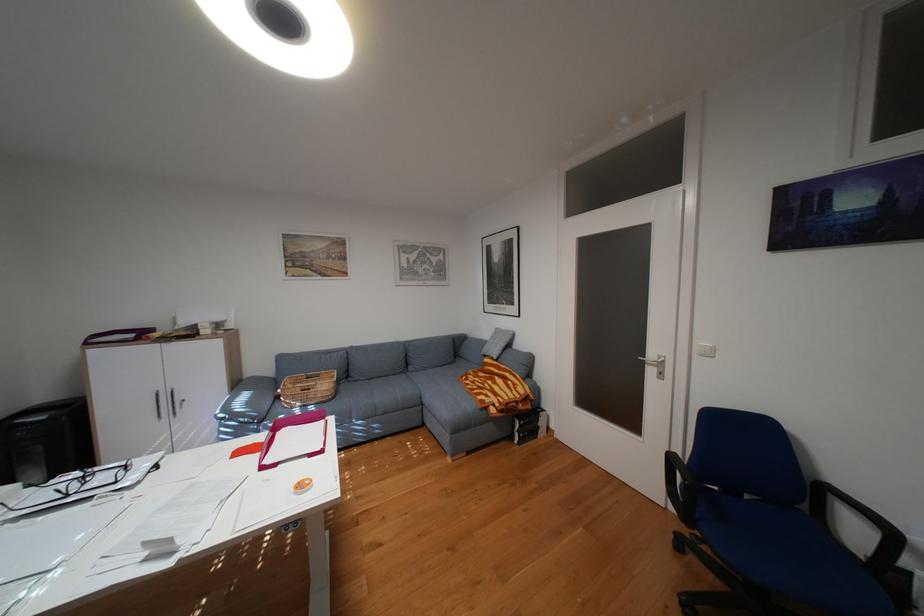
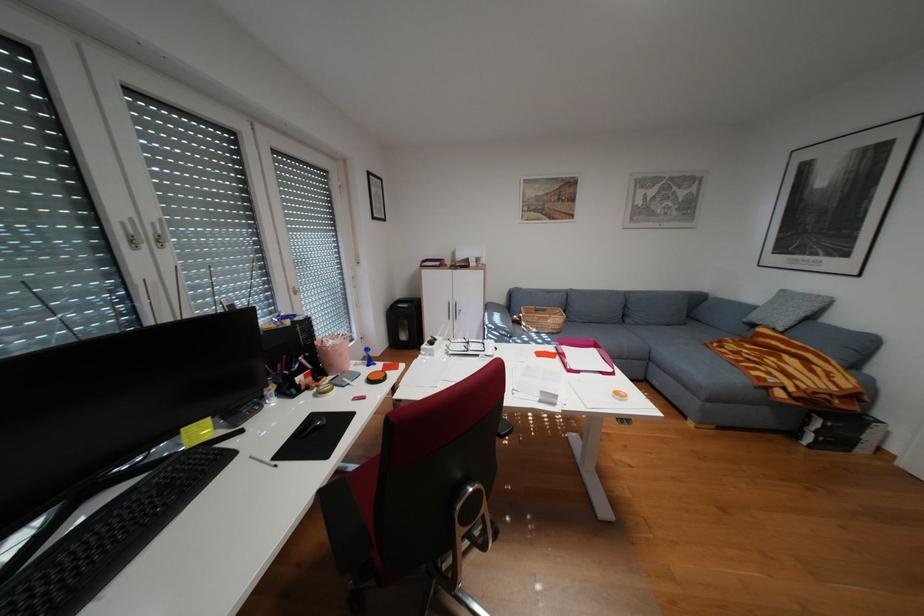
Find the pixel in the second image that matches (x=499, y=395) in the first image.

(782, 373)